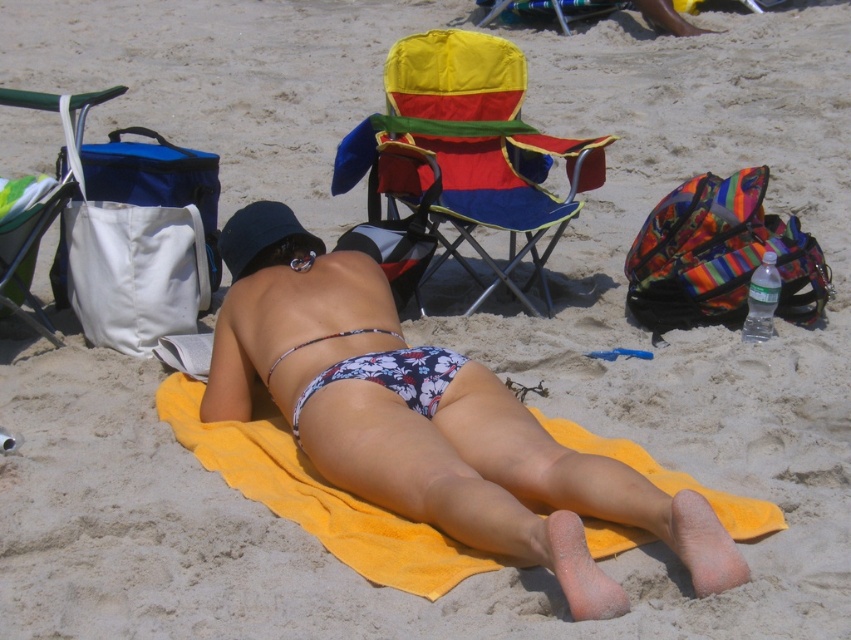
Between floral bikini bottom at center and white fabric bag at left, which one is positioned lower?

floral bikini bottom at center is lower down.

Can you confirm if floral bikini bottom at center is smaller than white fabric bag at left?

No, floral bikini bottom at center is not smaller than white fabric bag at left.

Which is in front, point (461, 428) or point (4, 104)?

Point (461, 428)

Identify the location of floral bikini bottom at center. (483, 465).

Is floral bikini bottom at center to the right of floral fabric bikini bottom at center from the viewer's perspective?

Yes, floral bikini bottom at center is to the right of floral fabric bikini bottom at center.

Is point (392, 419) positioned in front of point (386, 364)?

Yes, it is.

Is point (324, 316) positioned after point (377, 364)?

Yes, it is.

Find the location of a particular element. The height and width of the screenshot is (640, 851). floral bikini bottom at center is located at coordinates (483, 465).

Which is above, white fabric bag at left or floral fabric bikini top at center?

white fabric bag at left

Can you confirm if white fabric bag at left is positioned to the left of floral fabric bikini top at center?

Indeed, white fabric bag at left is positioned on the left side of floral fabric bikini top at center.

Describe the element at coordinates (27, 253) in the screenshot. I see `white fabric bag at left` at that location.

The image size is (851, 640). Find the location of `white fabric bag at left`. white fabric bag at left is located at coordinates point(27,253).